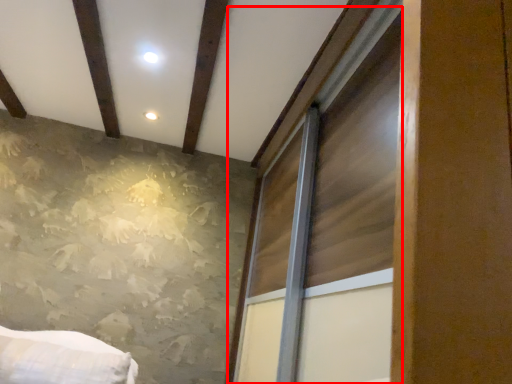
Question: From the image, what is the correct spatial relationship of window (annotated by the red box) in relation to plank?

Choices:
 (A) right
 (B) left

Answer: (A)